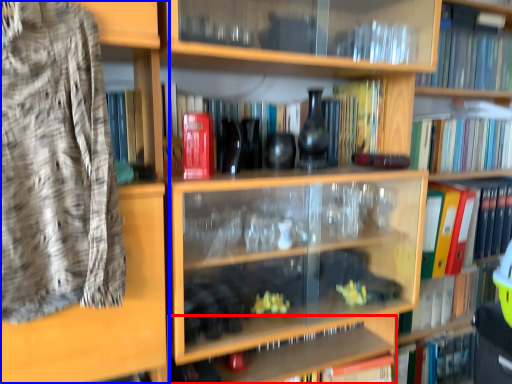
Question: Which object appears closest to the camera in this image, cabinet (highlighted by a red box) or shelf (highlighted by a blue box)?

Choices:
 (A) cabinet
 (B) shelf

Answer: (B)